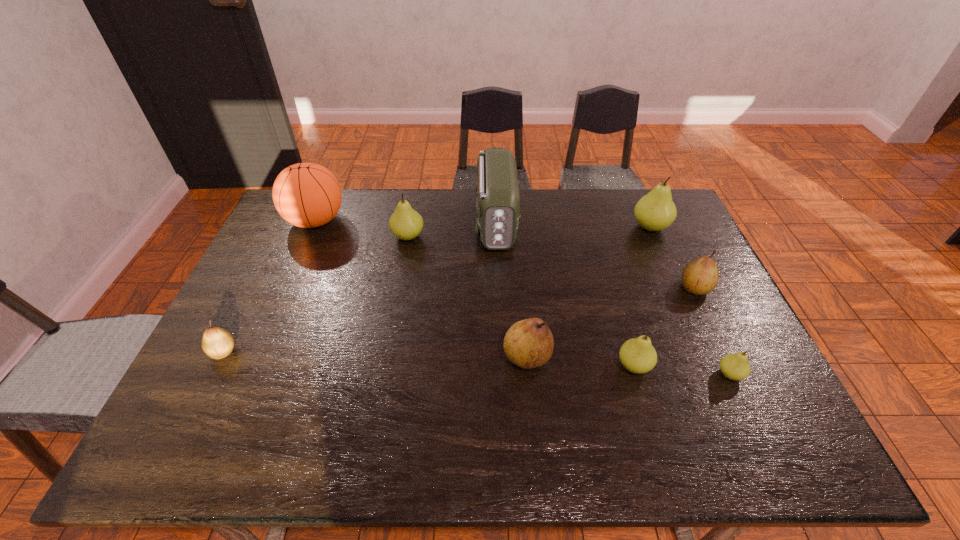
This screenshot has height=540, width=960. I want to click on radio_receiver, so click(x=497, y=191).

The width and height of the screenshot is (960, 540). I want to click on basketball, so click(x=307, y=195).

Image resolution: width=960 pixels, height=540 pixels. Identify the location of the tallest pear. (655, 211).

Identify the location of the second biggest green pear. Image resolution: width=960 pixels, height=540 pixels. (405, 223).

At what (x,y) coordinates should I click in order to perform the action: click on the third object from left to right. Please return your answer as a coordinate pair (x, y). The image size is (960, 540). Looking at the image, I should click on (405, 223).

You are a GUI agent. You are given a task and a screenshot of the screen. Output one action in this format:
    pyautogui.click(x=<x>, y=<y>)
    Task: Click on the second brown pear from left to right
    
    Given the screenshot: What is the action you would take?
    pyautogui.click(x=529, y=343)

You are a GUI agent. You are given a task and a screenshot of the screen. Output one action in this format:
    pyautogui.click(x=<x>, y=<y>)
    Task: Click on the biggest brown pear
    This screenshot has height=540, width=960.
    Given the screenshot: What is the action you would take?
    pyautogui.click(x=529, y=343)

Locate an element on the screen. This screenshot has width=960, height=540. the fifth nearest pear is located at coordinates (699, 277).

Find the location of `the second smallest brown pear`. the second smallest brown pear is located at coordinates (699, 277).

Locate an element on the screen. The height and width of the screenshot is (540, 960). the fourth pear from right to left is located at coordinates (637, 355).